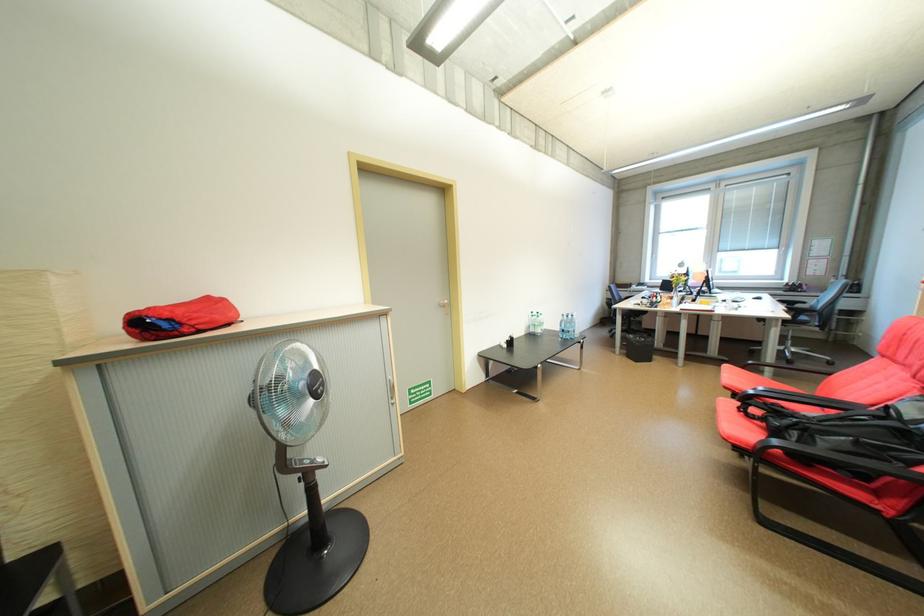
At what (x,y) coordinates should I click in order to perform the action: click on chair sitting surface. Please return your answer as a coordinate pair (x, y). Looking at the image, I should click on (749, 377).